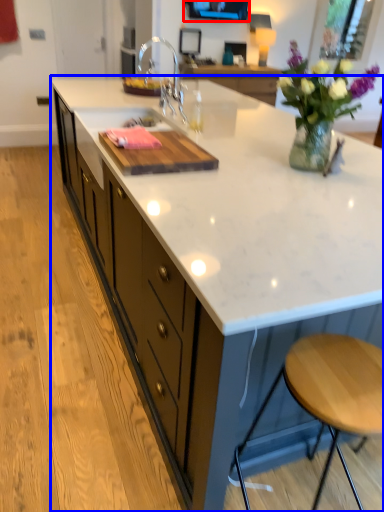
Question: Which object appears farthest to the camera in this image, window screen (highlighted by a red box) or countertop (highlighted by a blue box)?

Choices:
 (A) window screen
 (B) countertop

Answer: (A)